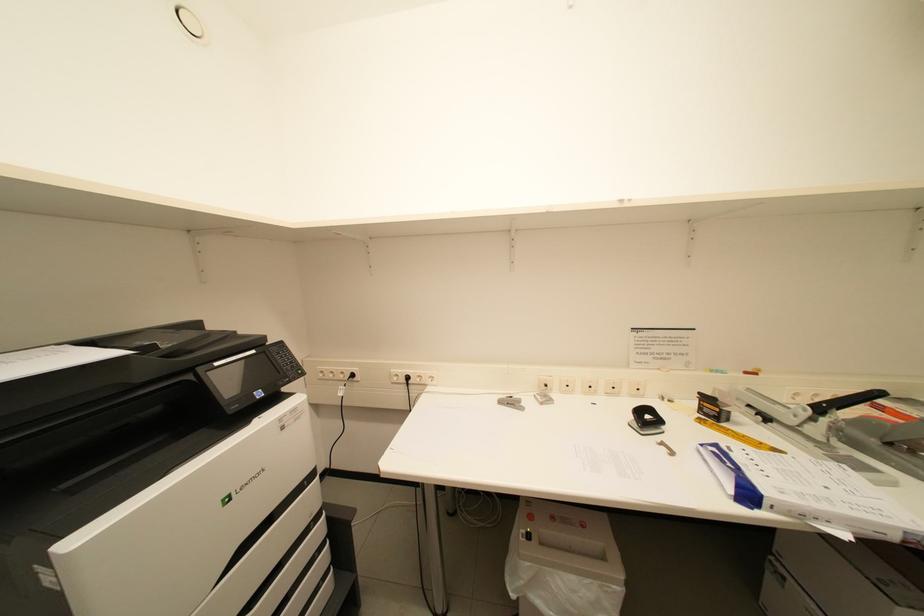
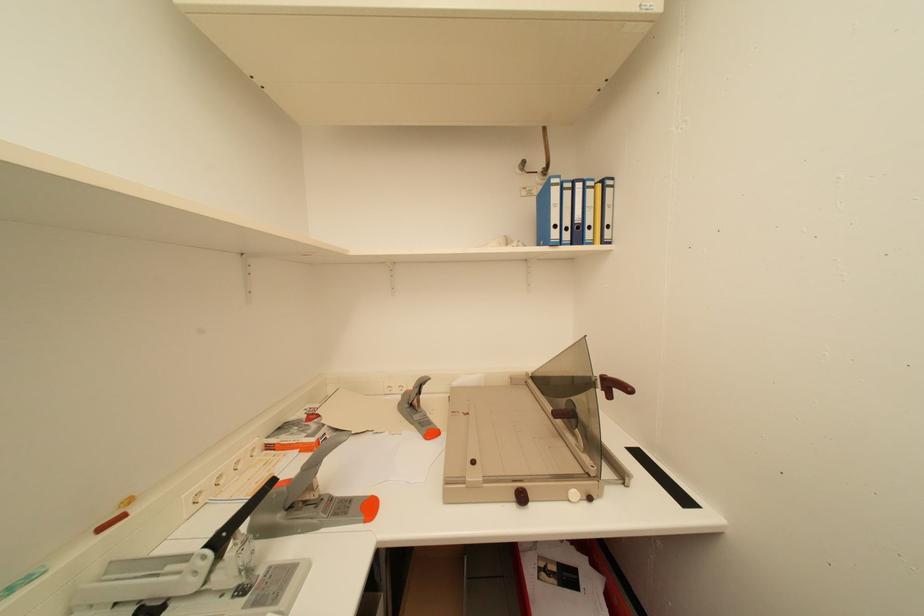
Question: How did the camera likely rotate?

Choices:
 (A) Left
 (B) Right
 (C) Up
 (D) Down

Answer: (B)